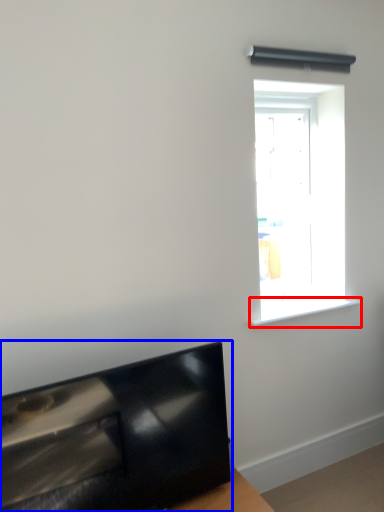
Question: Which of the following is the farthest to the observer, window sill (highlighted by a red box) or furniture (highlighted by a blue box)?

Choices:
 (A) window sill
 (B) furniture

Answer: (A)